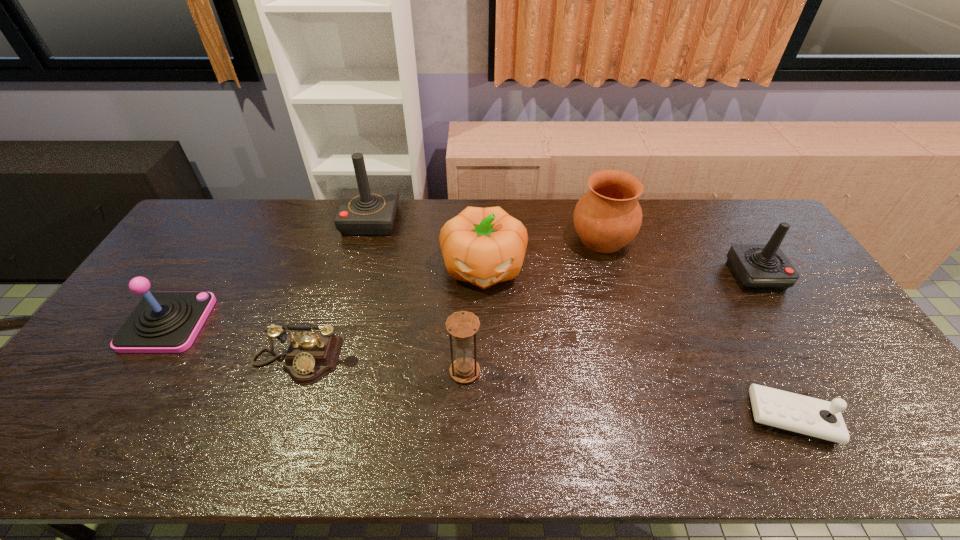
Identify the location of vacant region that satisfies the following two spatial constraints: 1. on the rectangular base of the farthest joystick; 2. on the dial of the telephone. (331, 361).

This screenshot has height=540, width=960. I want to click on vacant space that satisfies the following two spatial constraints: 1. on the carved face of the pumpkin; 2. forward from the base of the second nearest joystick, so click(x=484, y=323).

This screenshot has height=540, width=960. In order to click on vacant space that satisfies the following two spatial constraints: 1. on the front side of the pottery; 2. forward from the base of the third tallest joystick in this screenshot , I will do tap(627, 323).